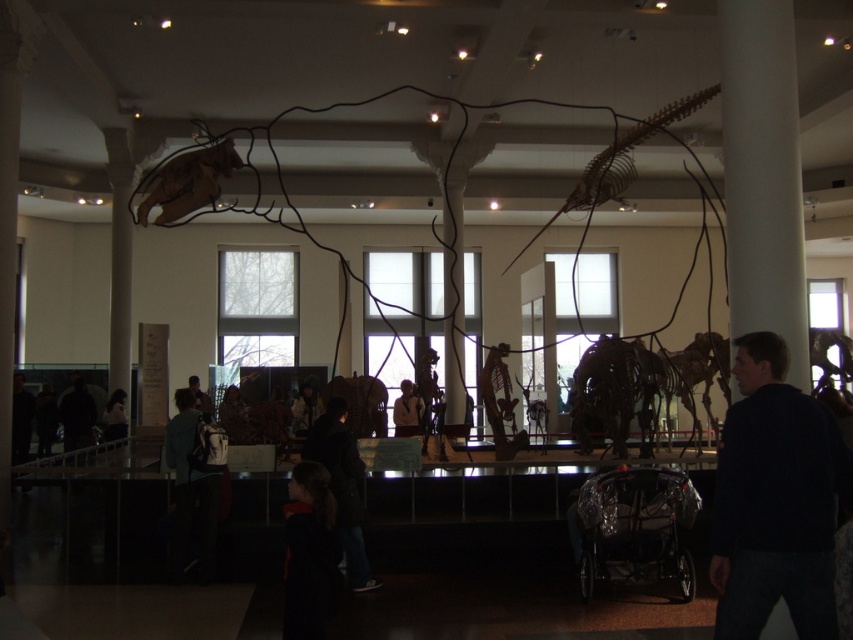
Question: Based on their relative distances, which object is farther from the dark blue jacket at lower left?

Choices:
 (A) dark hair at lower center
 (B) dark blue jeans at center
 (C) white fabric coat at center

Answer: (A)

Question: Does brown matte dinosaur at center have a lesser width compared to white fabric coat at center?

Choices:
 (A) no
 (B) yes

Answer: (B)

Question: Which of the following is the closest to the observer?

Choices:
 (A) brown matte dinosaur at center
 (B) dark blue sweater at right
 (C) brown matte dinosaur at upper left

Answer: (B)

Question: Can you confirm if dark fabric jacket at center is wider than light brown leather jacket at center?

Choices:
 (A) no
 (B) yes

Answer: (B)

Question: Does dark hair at lower center appear on the left side of dark blue jacket at center?

Choices:
 (A) no
 (B) yes

Answer: (A)

Question: Which object is farther from the camera taking this photo?

Choices:
 (A) brown matte dinosaur at center
 (B) light brown leather jacket at center

Answer: (B)